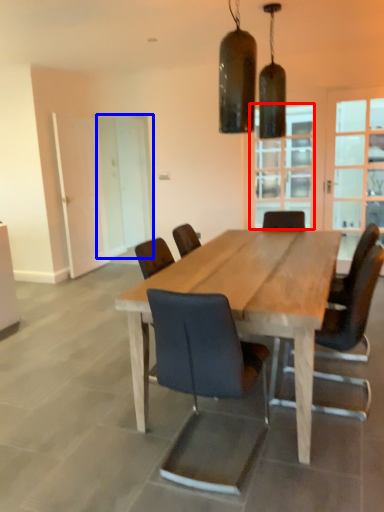
Question: Which point is closer to the camera, window (highlighted by a red box) or screen door (highlighted by a blue box)?

Choices:
 (A) window
 (B) screen door

Answer: (A)